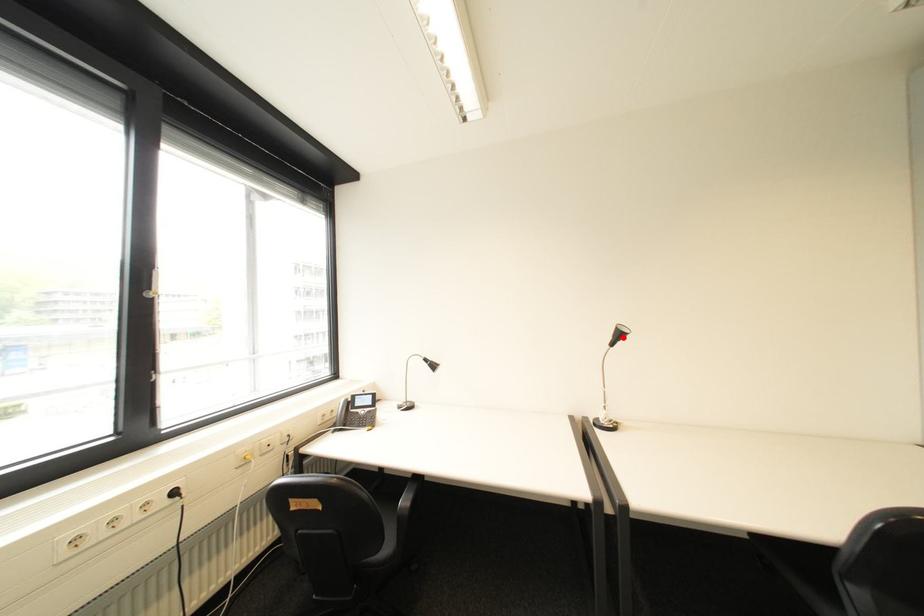
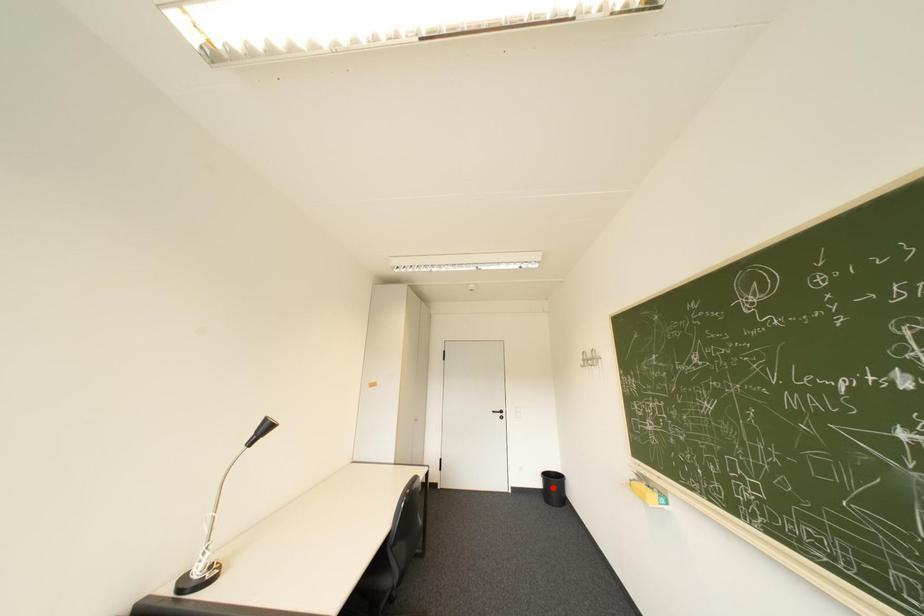
I am providing you with two images of the same scene from different viewpoints. A red point is marked on the first image and another point is marked on the second image. Is the red point in image1 aligned with the point shown in image2?

No